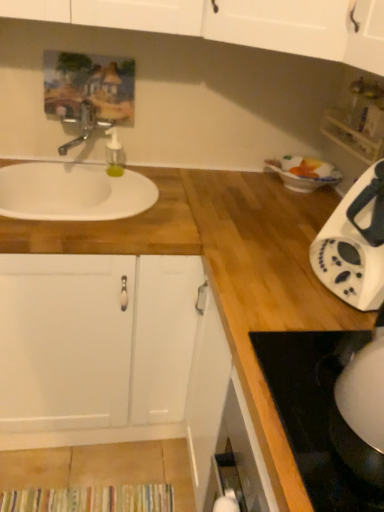
Question: From the image's perspective, is white matte cabinet at left positioned above or below metallic faucet at upper left?

Choices:
 (A) below
 (B) above

Answer: (A)

Question: From a real-world perspective, is white matte cabinet at left above or below metallic faucet at upper left?

Choices:
 (A) below
 (B) above

Answer: (A)

Question: Which object is positioned farthest from the clear plastic soap dispenser at upper center?

Choices:
 (A) white glossy kettle at lower right
 (B) white plastic toaster at right
 (C) white plastic shelf at upper right
 (D) white glossy electric kettle at lower right
 (E) white wood countertop at left

Answer: (D)

Question: Considering the real-world distances, which object is closest to the white glossy kettle at lower right?

Choices:
 (A) white matte cabinet at left
 (B) white glossy bowl at upper right
 (C) white wood countertop at left
 (D) white plastic shelf at upper right
 (E) clear plastic soap dispenser at upper center

Answer: (C)